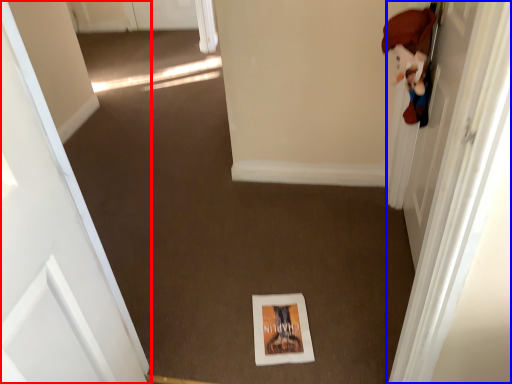
Question: Which of the following is the farthest to the observer, door (highlighted by a red box) or door (highlighted by a blue box)?

Choices:
 (A) door
 (B) door

Answer: (B)